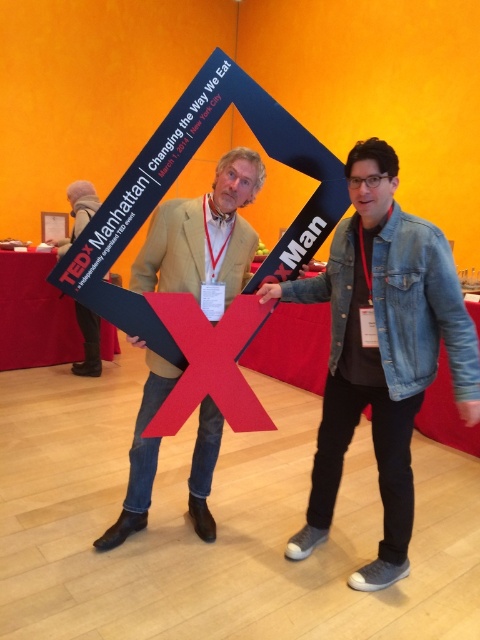
Is light brown leather jacket at center to the right of matte black sign at left from the viewer's perspective?

Indeed, light brown leather jacket at center is positioned on the right side of matte black sign at left.

Is light brown leather jacket at center below matte black sign at left?

Yes, light brown leather jacket at center is below matte black sign at left.

Describe the element at coordinates (204, 237) in the screenshot. Image resolution: width=480 pixels, height=640 pixels. I see `light brown leather jacket at center` at that location.

Find the location of a particular element. light brown leather jacket at center is located at coordinates (204, 237).

Measure the distance between denim jacket at lower right and light brown leather jacket at center.

A distance of 19.18 inches exists between denim jacket at lower right and light brown leather jacket at center.

In the scene shown: Between denim jacket at lower right and light brown leather jacket at center, which one appears on the left side from the viewer's perspective?

Positioned to the left is light brown leather jacket at center.

Find the location of a particular element. This screenshot has height=640, width=480. denim jacket at lower right is located at coordinates (382, 349).

Can you confirm if denim jacket at lower right is positioned above matte black sign at left?

No, denim jacket at lower right is not above matte black sign at left.

The width and height of the screenshot is (480, 640). Describe the element at coordinates (382, 349) in the screenshot. I see `denim jacket at lower right` at that location.

Locate an element on the screen. denim jacket at lower right is located at coordinates (382, 349).